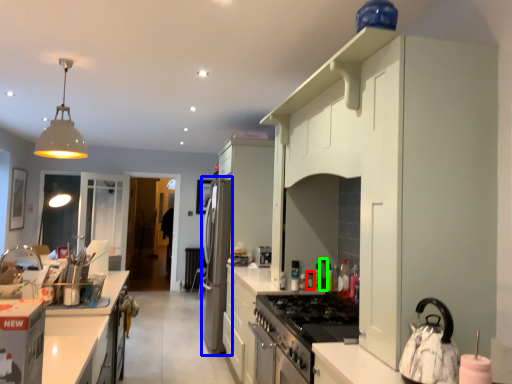
Question: Which is farther away from appliance (highlighted by a red box)? appliance (highlighted by a blue box) or bottle (highlighted by a green box)?

Choices:
 (A) appliance
 (B) bottle

Answer: (A)